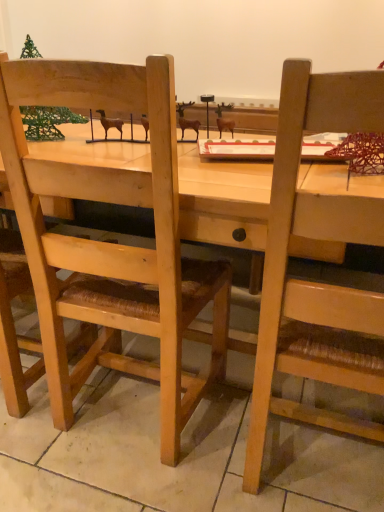
Find the location of a particular element. The height and width of the screenshot is (512, 384). vacant space to the left of wooden chair at right, which appears as the 2th chair when viewed from the left is located at coordinates (179, 452).